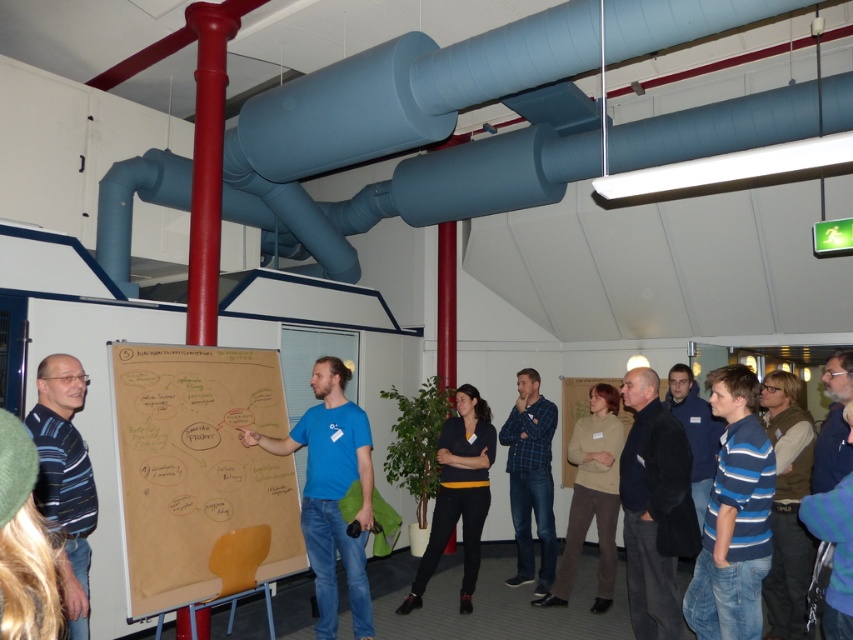
You are a photographer standing at the back of the room. You want to take a photo of both the black matte sweater at center and the blue striped shirt at center in the same frame. Can you fit both of them into the photo without moving your position?

The black matte sweater at center and the blue striped shirt at center are 5.19 feet apart. Since the distance between them is within the camera frame, you can fit both into the photo without moving.

You are standing in the office and want to place a new poster exactly where the black matte sweater at center is currently located. What are the coordinates of the spot where you should place the poster?

The coordinates for the black matte sweater at center are at point (x=457, y=493), so you should place the poster there.

In the scene shown: You are attending a meeting and notice two people wearing the dark blue fabric jacket at center and the beige sweater at center. Which clothing item is located to the right of the other?

The dark blue fabric jacket at center is positioned on the right side of the beige sweater at center.